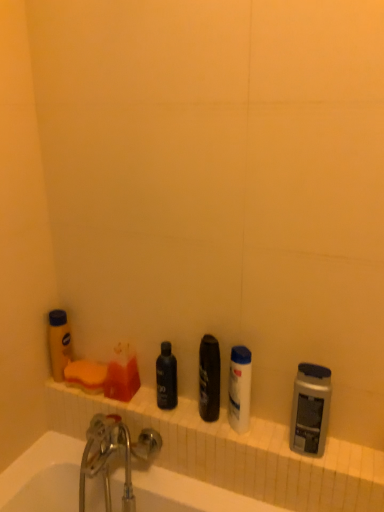
Question: In which direction should I rotate to look at shiny black can at center, placed as the fourth toiletry when sorted from left to right?

Choices:
 (A) right
 (B) left

Answer: (A)

Question: Is white ceramic ledge at lower center in front of white plastic mouthwash at center?

Choices:
 (A) yes
 (B) no

Answer: (A)

Question: From the image's perspective, is white ceramic ledge at lower center over white plastic mouthwash at center?

Choices:
 (A) yes
 (B) no

Answer: (B)

Question: Is the position of white ceramic ledge at lower center more distant than that of white plastic mouthwash at center?

Choices:
 (A) yes
 (B) no

Answer: (B)

Question: From a real-world perspective, is white ceramic ledge at lower center positioned under white plastic mouthwash at center based on gravity?

Choices:
 (A) yes
 (B) no

Answer: (A)

Question: Is white plastic mouthwash at center at the back of white ceramic ledge at lower center?

Choices:
 (A) yes
 (B) no

Answer: (B)

Question: Is white ceramic ledge at lower center located outside white plastic mouthwash at center?

Choices:
 (A) no
 (B) yes

Answer: (B)

Question: From a real-world perspective, is black matte bottle at center, which is the third toiletry in left-to-right order, under white ceramic bathtub at lower left?

Choices:
 (A) no
 (B) yes

Answer: (A)

Question: Is black matte bottle at center, which is the third toiletry in left-to-right order, positioned in front of white ceramic bathtub at lower left?

Choices:
 (A) no
 (B) yes

Answer: (A)

Question: Does black matte bottle at center, which is the third toiletry in left-to-right order, have a larger size compared to white ceramic bathtub at lower left?

Choices:
 (A) yes
 (B) no

Answer: (B)

Question: Considering the relative sizes of black matte bottle at center, marked as the 3th toiletry in a right-to-left arrangement, and white ceramic bathtub at lower left in the image provided, is black matte bottle at center, marked as the 3th toiletry in a right-to-left arrangement, wider than white ceramic bathtub at lower left?

Choices:
 (A) no
 (B) yes

Answer: (A)

Question: From the image's perspective, does black matte bottle at center, which is the third toiletry in left-to-right order, appear lower than white ceramic bathtub at lower left?

Choices:
 (A) yes
 (B) no

Answer: (B)

Question: Does black matte bottle at center, which is the third toiletry in left-to-right order, have a smaller size compared to white ceramic bathtub at lower left?

Choices:
 (A) no
 (B) yes

Answer: (B)

Question: Considering the relative sizes of white ceramic ledge at lower center and yellow matte bottle at left, marked as the 1th toiletry in a left-to-right arrangement, in the image provided, is white ceramic ledge at lower center bigger than yellow matte bottle at left, marked as the 1th toiletry in a left-to-right arrangement,?

Choices:
 (A) yes
 (B) no

Answer: (A)